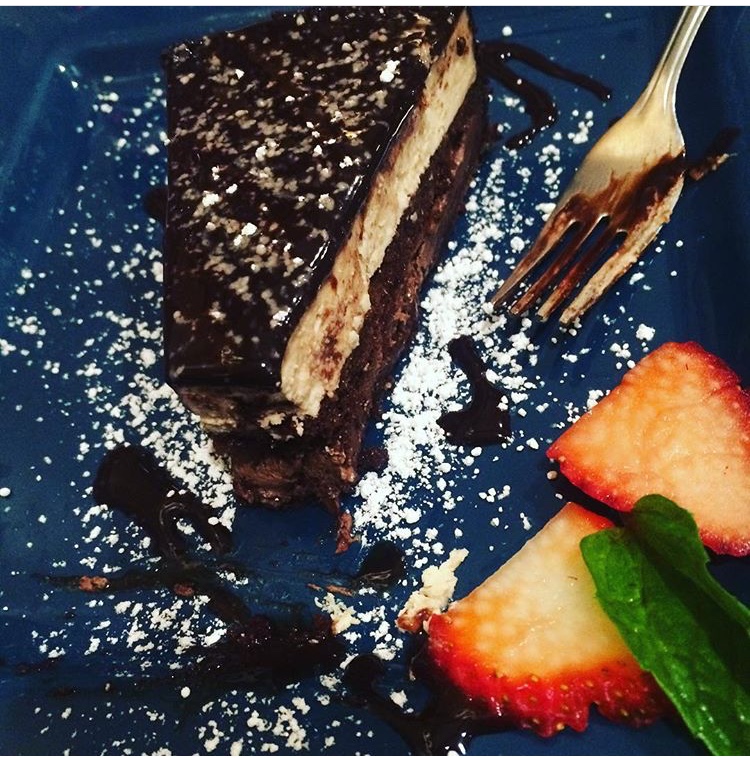
I want to click on edge of blue plate, so click(x=28, y=36).